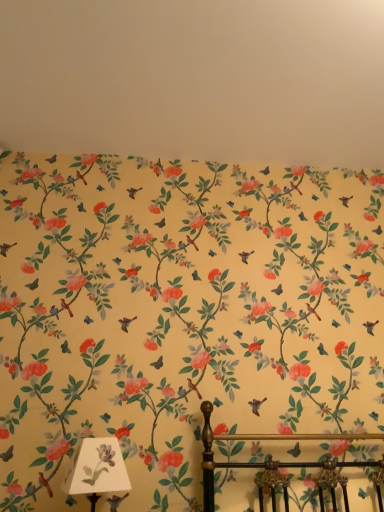
Question: Considering the positions of yellow floral wallpaper at upper center and white paper shade at lower left in the image, is yellow floral wallpaper at upper center wider or thinner than white paper shade at lower left?

Choices:
 (A) thin
 (B) wide

Answer: (B)

Question: Considering the positions of yellow floral wallpaper at upper center and white paper shade at lower left in the image, is yellow floral wallpaper at upper center bigger or smaller than white paper shade at lower left?

Choices:
 (A) big
 (B) small

Answer: (A)

Question: Is yellow floral wallpaper at upper center inside or outside of white paper shade at lower left?

Choices:
 (A) outside
 (B) inside

Answer: (A)

Question: Is point (79, 466) closer or farther from the camera than point (193, 22)?

Choices:
 (A) farther
 (B) closer

Answer: (B)

Question: From the image's perspective, is white paper shade at lower left positioned above or below yellow floral wallpaper at upper center?

Choices:
 (A) below
 (B) above

Answer: (A)

Question: In terms of width, does white paper shade at lower left look wider or thinner when compared to yellow floral wallpaper at upper center?

Choices:
 (A) wide
 (B) thin

Answer: (B)

Question: From a real-world perspective, is white paper shade at lower left positioned above or below yellow floral wallpaper at upper center?

Choices:
 (A) above
 (B) below

Answer: (B)